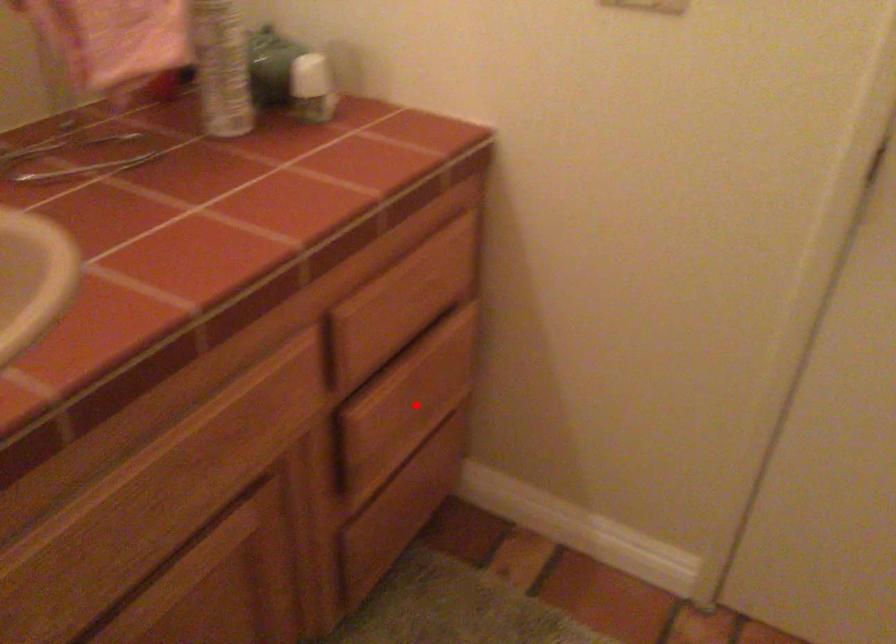
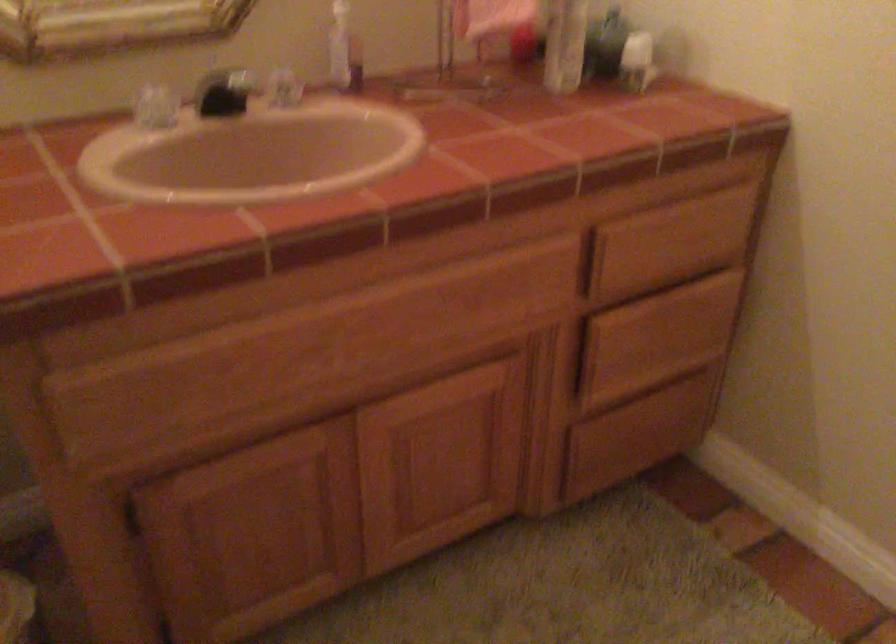
Where in the second image is the point corresponding to the highlighted location from the first image?

(657, 337)